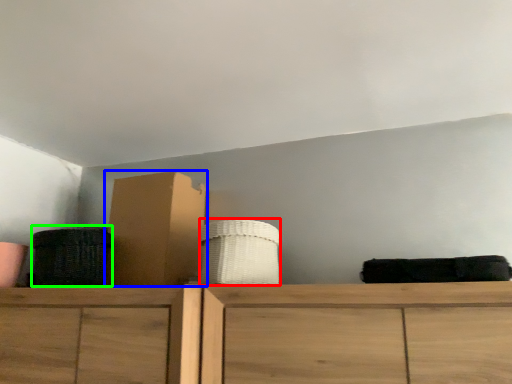
Question: Which object is the closest to the basket (highlighted by a red box)? Choose among these: cardboard box (highlighted by a blue box) or basket (highlighted by a green box).

Choices:
 (A) cardboard box
 (B) basket

Answer: (A)